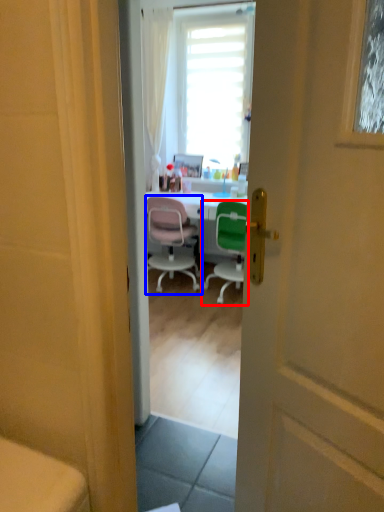
Question: Which object appears farthest to the camera in this image, chair (highlighted by a red box) or chair (highlighted by a blue box)?

Choices:
 (A) chair
 (B) chair

Answer: (B)